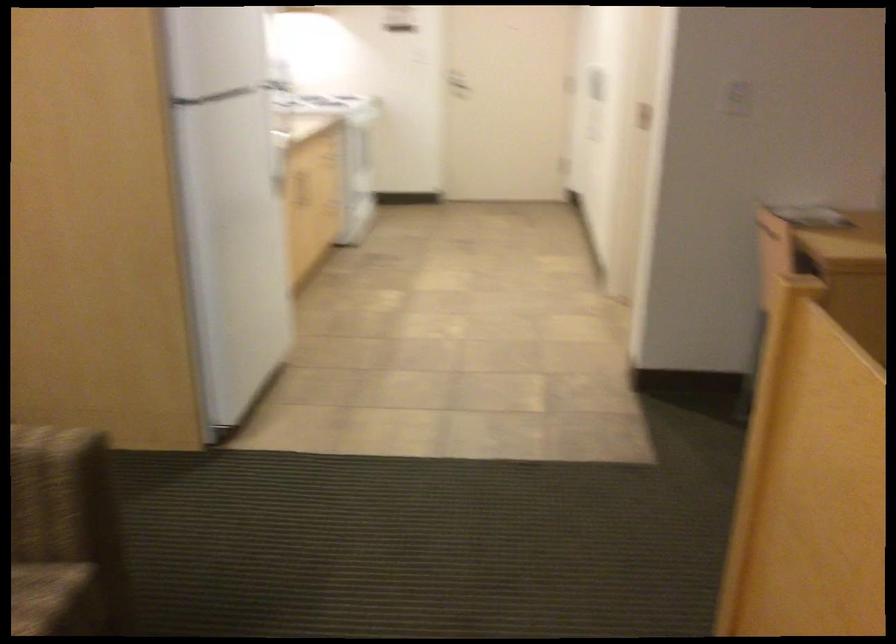
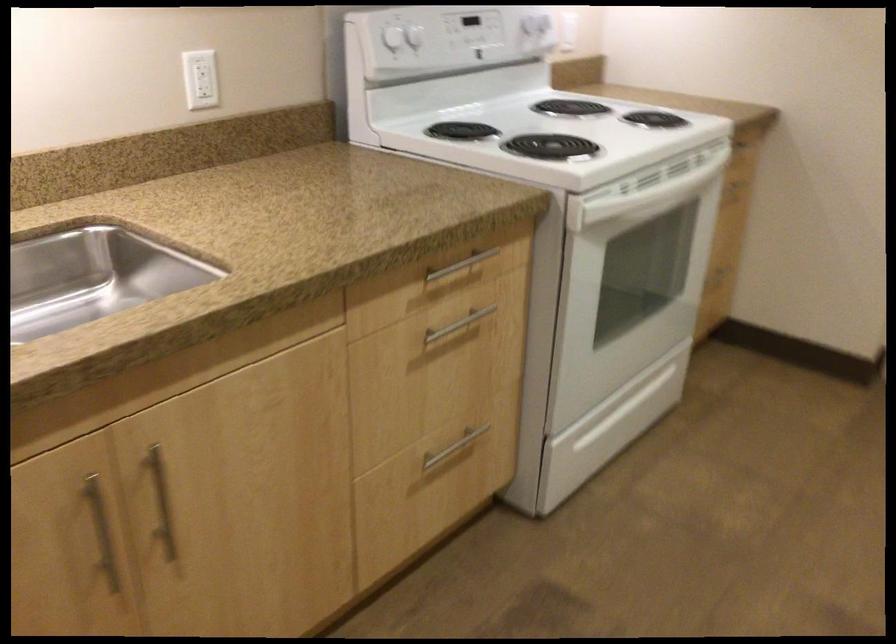
Locate, in the second image, the point that corresponds to (357,151) in the first image.

(457, 325)